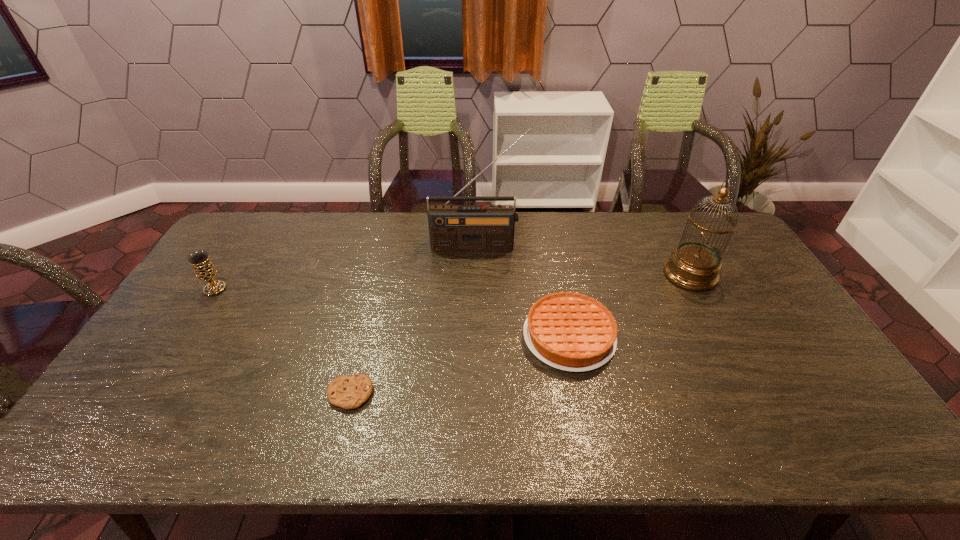
In the image, there is a desktop. Identify the location of free region at the far edge. Image resolution: width=960 pixels, height=540 pixels. (279, 227).

This screenshot has width=960, height=540. In order to click on vacant point at the near edge in this screenshot , I will do `click(173, 432)`.

In the image, there is a desktop. At what (x,y) coordinates should I click in order to perform the action: click on vacant space at the left edge. Please return your answer as a coordinate pair (x, y). Looking at the image, I should click on (193, 312).

Image resolution: width=960 pixels, height=540 pixels. What are the coordinates of `free space at the right edge of the desktop` in the screenshot? It's located at (737, 265).

Where is `vacant area between the radio receiver and the shortest object`? The width and height of the screenshot is (960, 540). vacant area between the radio receiver and the shortest object is located at coordinates (414, 320).

Where is `unoccupied area between the farthest object and the second shortest object`? The image size is (960, 540). unoccupied area between the farthest object and the second shortest object is located at coordinates (523, 292).

Find the location of a particular element. The height and width of the screenshot is (540, 960). free space that is in between the second nearest object and the second object from left to right is located at coordinates (460, 365).

This screenshot has width=960, height=540. In order to click on empty location between the leftmost object and the shortest object in this screenshot , I will do `click(282, 341)`.

Find the location of a particular element. Image resolution: width=960 pixels, height=540 pixels. empty location between the rightmost object and the farthest object is located at coordinates point(584,261).

Where is `empty space between the fourth tallest object and the radio receiver`? empty space between the fourth tallest object and the radio receiver is located at coordinates (523, 292).